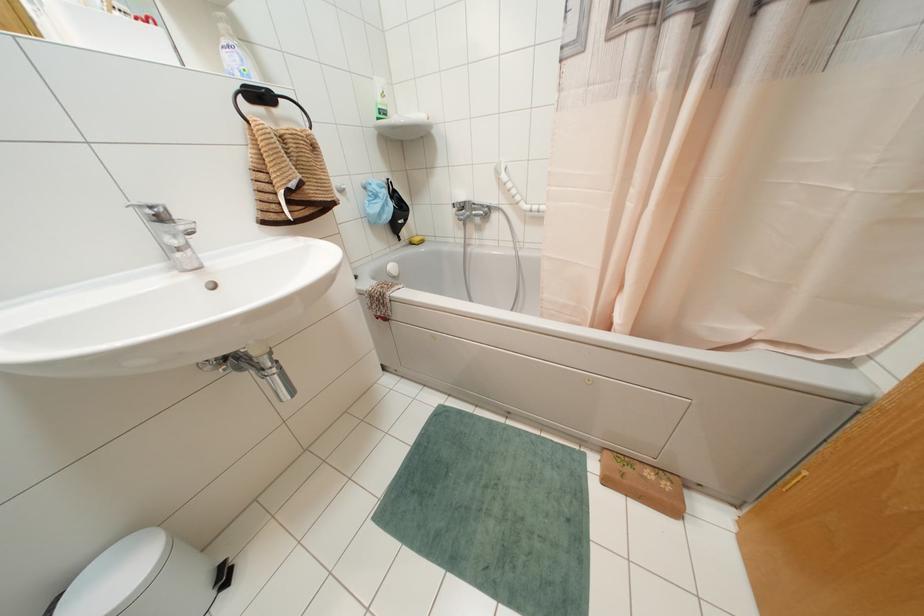
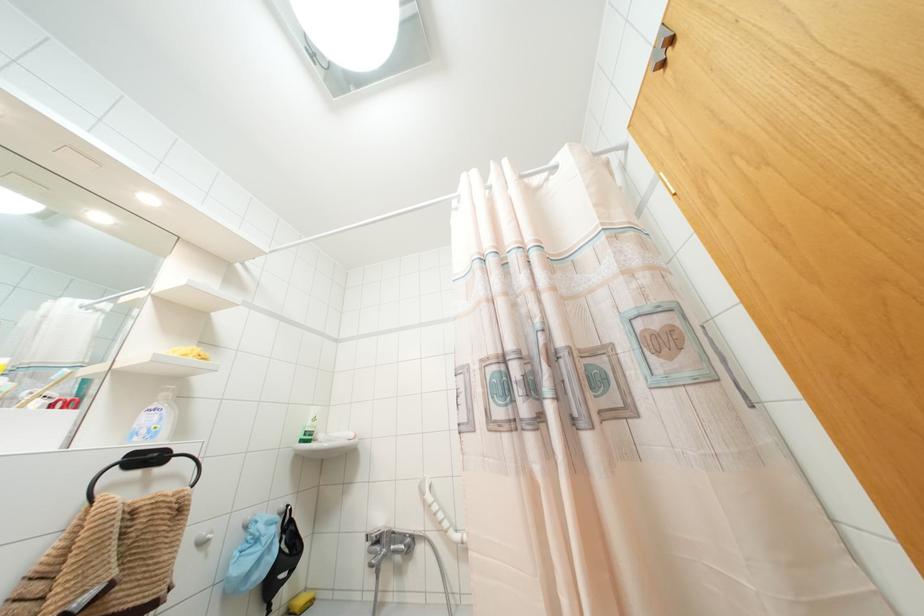
Find the pixel in the second image that matches [382,94] in the first image.

(312, 419)